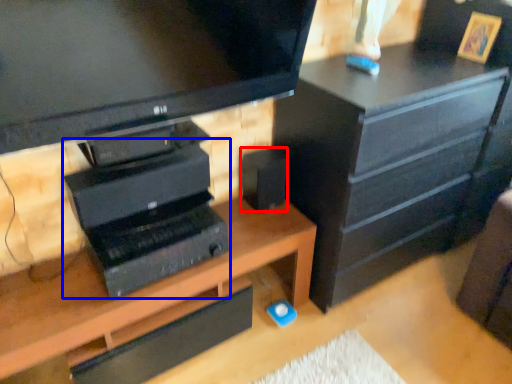
Question: Which object appears closest to the camera in this image, speaker (highlighted by a red box) or computer (highlighted by a blue box)?

Choices:
 (A) speaker
 (B) computer

Answer: (B)